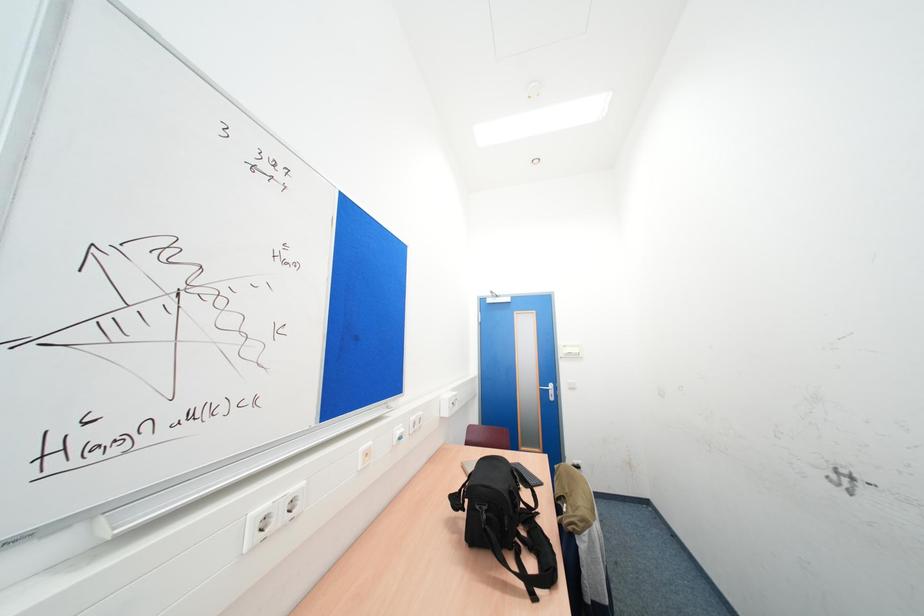
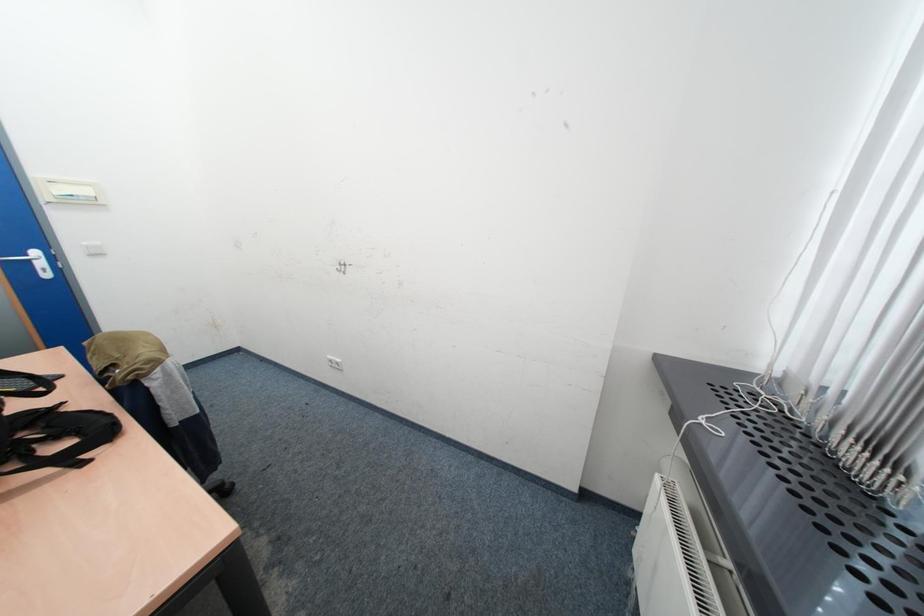
The first image is from the beginning of the video and the second image is from the end. How did the camera likely rotate when shooting the video?

The camera's rotation is toward right-down.